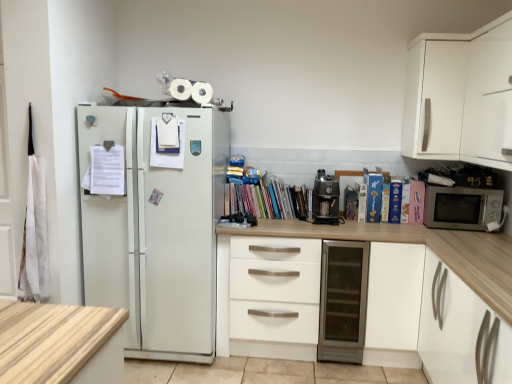
At what (x,y) coordinates should I click in order to perform the action: click on free space in front of hardcover book at right, which is the 4th paperback book in right-to-left order. Please return your answer as a coordinate pair (x, y). This screenshot has height=384, width=512. Looking at the image, I should click on (387, 225).